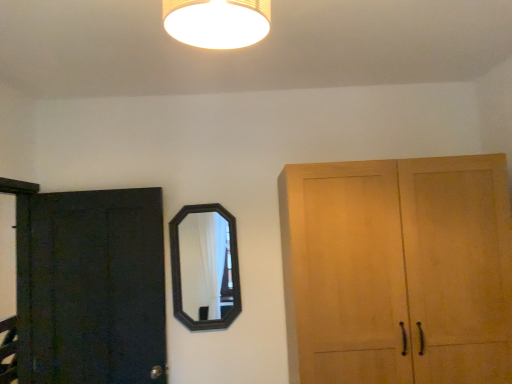
Describe the element at coordinates (217, 22) in the screenshot. I see `matte yellow lampshade at upper center` at that location.

You are a GUI agent. You are given a task and a screenshot of the screen. Output one action in this format:
    pyautogui.click(x=<x>, y=<y>)
    Task: Click on the dark matte wood door at left
    The image size is (512, 384).
    Given the screenshot: What is the action you would take?
    pyautogui.click(x=93, y=286)

What is the approximate height of dark matte wood door at left?

dark matte wood door at left is 1.10 meters tall.

Describe the element at coordinates (205, 266) in the screenshot. I see `black wooden mirror at center` at that location.

This screenshot has width=512, height=384. I want to click on matte yellow lampshade at upper center, so click(x=217, y=22).

Is dark matte wood door at left not close to black wooden mirror at center?

They are positioned close to each other.

Considering the points (45, 308) and (226, 225), which point is in front, point (45, 308) or point (226, 225)?

The point (45, 308) is in front.

How many degrees apart are the facing directions of dark matte wood door at left and black wooden mirror at center?

The angle between the facing direction of dark matte wood door at left and the facing direction of black wooden mirror at center is 6.12 degrees.

From a real-world perspective, is dark matte wood door at left under black wooden mirror at center?

Correct, in the physical world, dark matte wood door at left is lower than black wooden mirror at center.

Which of these two, black wooden mirror at center or matte yellow lampshade at upper center, is thinner?

black wooden mirror at center.

Consider the image. Relative to matte yellow lampshade at upper center, is black wooden mirror at center in front or behind?

Visually, black wooden mirror at center is located behind matte yellow lampshade at upper center.

Considering the sizes of black wooden mirror at center and matte yellow lampshade at upper center in the image, is black wooden mirror at center taller or shorter than matte yellow lampshade at upper center?

In the image, black wooden mirror at center appears to be taller than matte yellow lampshade at upper center.

How many degrees apart are the facing directions of black wooden mirror at center and matte yellow lampshade at upper center?

The angle between the facing direction of black wooden mirror at center and the facing direction of matte yellow lampshade at upper center is 98.8 degrees.

Is matte yellow lampshade at upper center next to black wooden mirror at center and touching it?

No.

Considering the relative positions of matte yellow lampshade at upper center and black wooden mirror at center in the image provided, is matte yellow lampshade at upper center behind black wooden mirror at center?

No.

In terms of size, does matte yellow lampshade at upper center appear bigger or smaller than black wooden mirror at center?

Considering their sizes, matte yellow lampshade at upper center takes up less space than black wooden mirror at center.

Could you tell me if matte yellow lampshade at upper center is turned towards black wooden mirror at center?

No.

Choose the correct answer: Is dark matte wood door at left inside matte yellow lampshade at upper center or outside it?

dark matte wood door at left cannot be found inside matte yellow lampshade at upper center.

Identify the location of door below the matte yellow lampshade at upper center (from a real-world perspective). Image resolution: width=512 pixels, height=384 pixels. point(93,286).

From their relative heights in the image, would you say dark matte wood door at left is taller or shorter than matte yellow lampshade at upper center?

dark matte wood door at left is taller than matte yellow lampshade at upper center.

Could you tell me if dark matte wood door at left is facing matte yellow lampshade at upper center?

No, dark matte wood door at left is not aimed at matte yellow lampshade at upper center.

The width and height of the screenshot is (512, 384). Find the location of `door that appears below the black wooden mirror at center (from the image's perspective)`. door that appears below the black wooden mirror at center (from the image's perspective) is located at coordinates (93, 286).

Consider the image. Is black wooden mirror at center aimed at dark matte wood door at left?

No, black wooden mirror at center is not aimed at dark matte wood door at left.

Consider the image. Does black wooden mirror at center touch dark matte wood door at left?

They are not placed beside each other.

Looking at this image, from the image's perspective, which is below, black wooden mirror at center or dark matte wood door at left?

dark matte wood door at left appears lower in the image.

Consider the image. Can you see matte yellow lampshade at upper center touching dark matte wood door at left?

matte yellow lampshade at upper center is not next to dark matte wood door at left, and they're not touching.

From the picture: Is matte yellow lampshade at upper center turned away from dark matte wood door at left?

No, matte yellow lampshade at upper center's orientation is not away from dark matte wood door at left.

From the image's perspective, which is below, matte yellow lampshade at upper center or dark matte wood door at left?

dark matte wood door at left is shown below in the image.

Where is `mirror behind the dark matte wood door at left`? This screenshot has height=384, width=512. mirror behind the dark matte wood door at left is located at coordinates tap(205, 266).

Find the location of a particular element. mirror that appears below the matte yellow lampshade at upper center (from a real-world perspective) is located at coordinates (205, 266).

Estimate the real-world distances between objects in this image. Which object is further from matte yellow lampshade at upper center, black wooden mirror at center or dark matte wood door at left?

The object further to matte yellow lampshade at upper center is dark matte wood door at left.

From the image, which object appears to be farther from dark matte wood door at left, matte yellow lampshade at upper center or black wooden mirror at center?

matte yellow lampshade at upper center is positioned further to the anchor dark matte wood door at left.

Looking at the image, which one is located closer to black wooden mirror at center, matte yellow lampshade at upper center or dark matte wood door at left?

dark matte wood door at left lies closer to black wooden mirror at center than the other object.

Looking at the image, which one is located further to dark matte wood door at left, black wooden mirror at center or matte yellow lampshade at upper center?

matte yellow lampshade at upper center is positioned further to the anchor dark matte wood door at left.

Looking at the image, which one is located closer to black wooden mirror at center, dark matte wood door at left or matte yellow lampshade at upper center?

dark matte wood door at left is closer to black wooden mirror at center.

From the image, which object appears to be farther from matte yellow lampshade at upper center, dark matte wood door at left or black wooden mirror at center?

Based on the image, dark matte wood door at left appears to be further to matte yellow lampshade at upper center.

Locate an element on the screen. Image resolution: width=512 pixels, height=384 pixels. door between matte yellow lampshade at upper center and black wooden mirror at center along the z-axis is located at coordinates (93, 286).